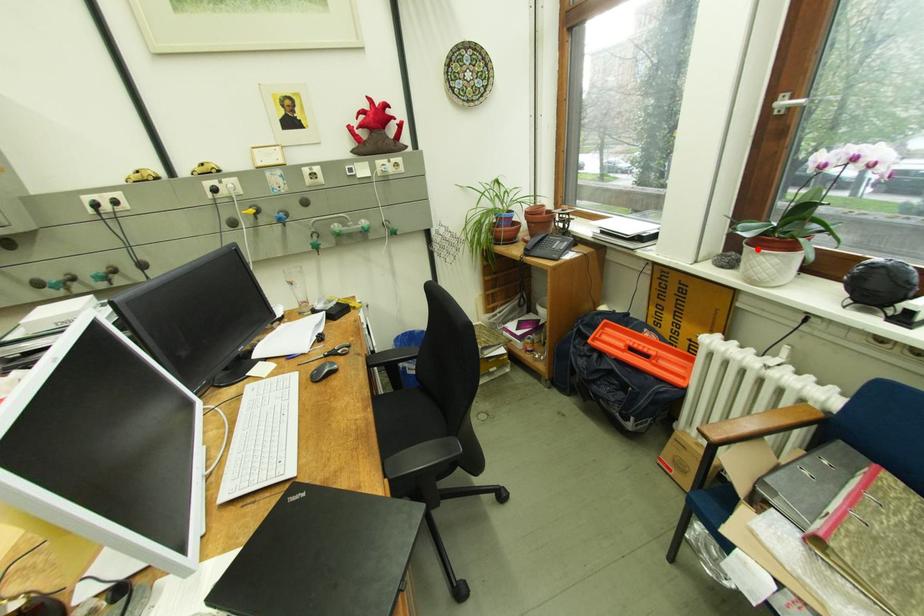
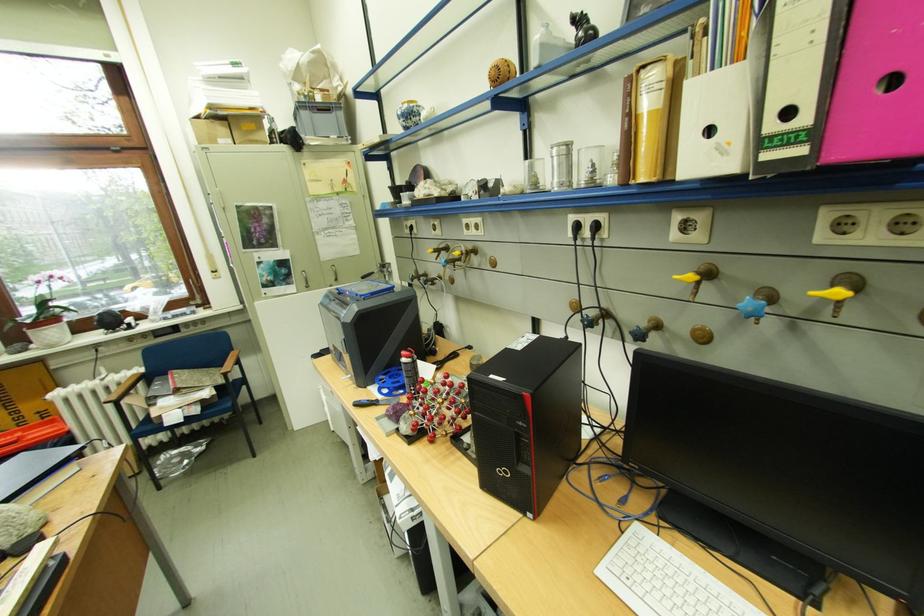
Question: I am providing you with two images of the same scene from different viewpoints. A red point is marked on the first image. Is the red point's position out of view in image 2?

Choices:
 (A) Yes
 (B) No

Answer: (B)